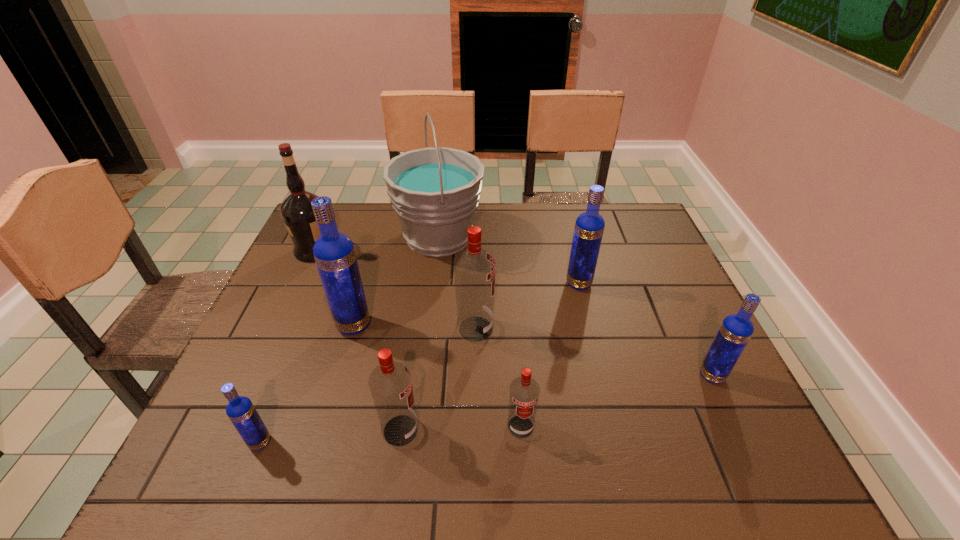
Locate an element on the screen. This screenshot has height=540, width=960. blue vodka that is the third nearest to the rightmost vodka is located at coordinates (240, 410).

I want to click on red vodka object that ranks as the closest to the second biggest red vodka, so click(x=524, y=391).

In order to click on the closest red vodka to the farthest blue vodka in this screenshot , I will do `click(474, 268)`.

Find the location of `vacant region that satisfies the following two spatial constraints: 1. on the front label of the rightmost vodka; 2. on the left side of the second red vodka from right to left`. vacant region that satisfies the following two spatial constraints: 1. on the front label of the rightmost vodka; 2. on the left side of the second red vodka from right to left is located at coordinates (475, 375).

The height and width of the screenshot is (540, 960). I want to click on free space in the image that satisfies the following two spatial constraints: 1. on the surface of the liquor; 2. on the back side of the rightmost blue vodka, so click(x=257, y=375).

Locate an element on the screen. free location that satisfies the following two spatial constraints: 1. on the surface of the liquor; 2. on the right side of the farthest vodka is located at coordinates (300, 284).

Find the location of a particular element. vacant space that satisfies the following two spatial constraints: 1. on the surface of the farthest blue vodka; 2. on the right side of the liquor is located at coordinates (300, 284).